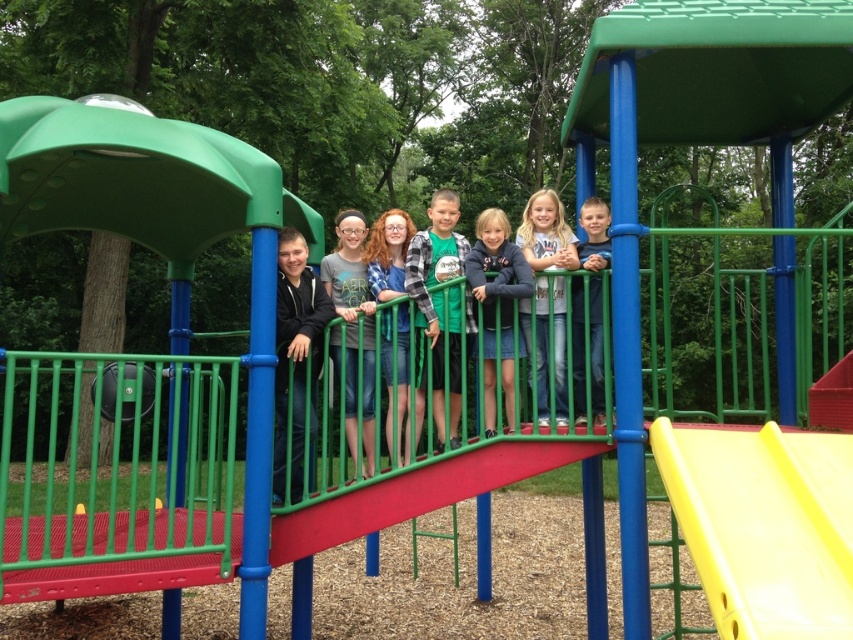
You are a photographer trying to capture a group photo of the children on the playground. You notice the white matte shirt at center and the dark blue denim skirt at center. Which clothing item appears narrower in the photo?

The white matte shirt at center appears narrower compared to the dark blue denim skirt at center.

You are a parent trying to locate your child who is wearing denim shorts at center. You see the yellow plastic slide at right. Which object is closer to you?

The yellow plastic slide at right is closer to the viewer than the denim shorts at center, so the slide is closer.